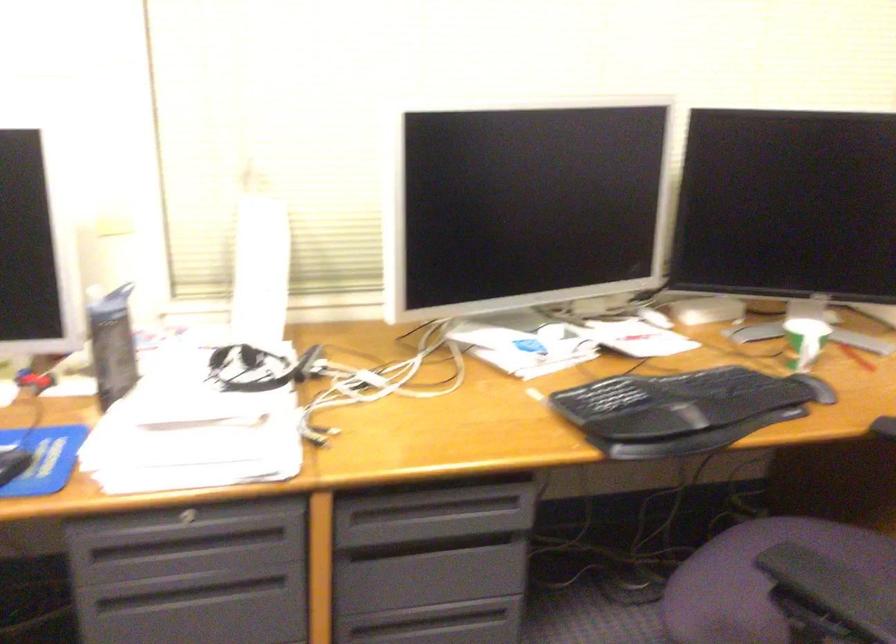
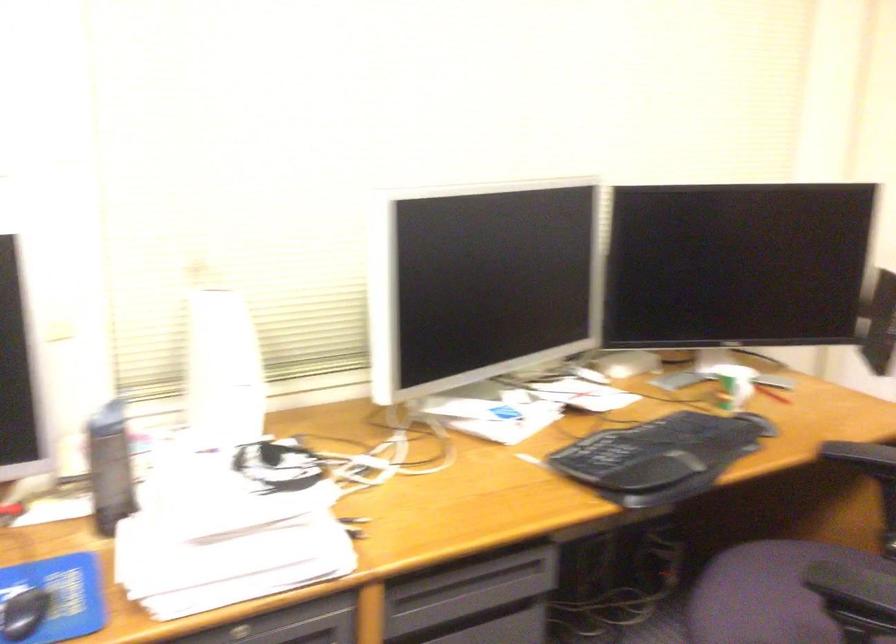
Question: Which direction would the cameraman need to move to produce the second image? Reply with the corresponding letter.

Choices:
 (A) Left
 (B) Right
 (C) Forward
 (D) Backward

Answer: (A)